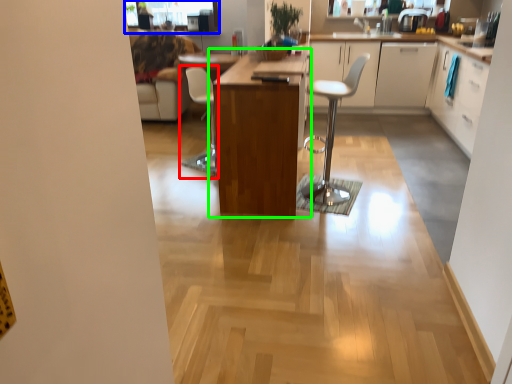
Question: Which object is the closest to the chair (highlighted by a red box)? Choose among these: window screen (highlighted by a blue box) or table (highlighted by a green box).

Choices:
 (A) window screen
 (B) table

Answer: (B)